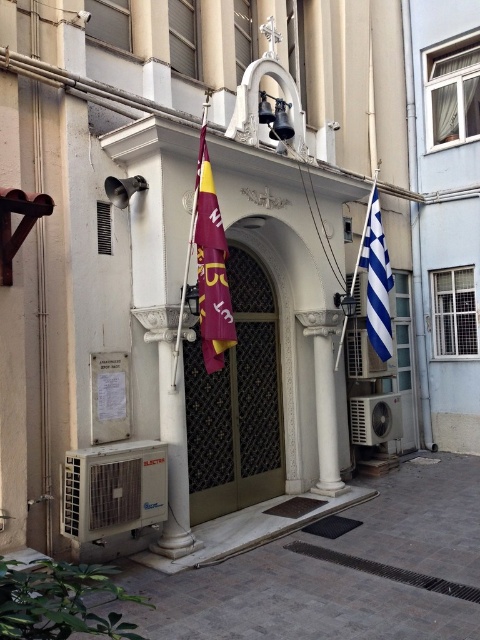
Is maroon fabric flag at center smaller than blue and white striped flag at right?

Yes, maroon fabric flag at center is smaller than blue and white striped flag at right.

Is point (202, 276) positioned before point (379, 252)?

Yes, it is in front of point (379, 252).

This screenshot has width=480, height=640. Describe the element at coordinates (211, 266) in the screenshot. I see `maroon fabric flag at center` at that location.

Where is `maroon fabric flag at center`? Image resolution: width=480 pixels, height=640 pixels. maroon fabric flag at center is located at coordinates (211, 266).

Is point (237, 504) in front of point (212, 316)?

No.

Between gold metallic door at center and maroon fabric flag at center, which one appears on the left side from the viewer's perspective?

maroon fabric flag at center

The height and width of the screenshot is (640, 480). Describe the element at coordinates (237, 403) in the screenshot. I see `gold metallic door at center` at that location.

Find the location of a particular element. This screenshot has width=480, height=640. gold metallic door at center is located at coordinates (237, 403).

Who is more forward, (226, 445) or (385, 324)?

Positioned in front is point (226, 445).

I want to click on gold metallic door at center, so click(x=237, y=403).